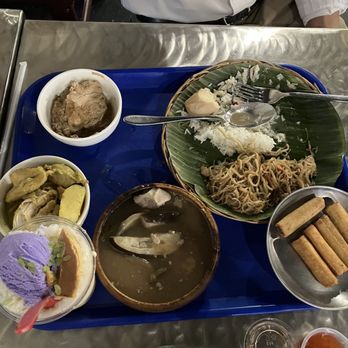
Image resolution: width=348 pixels, height=348 pixels. In order to click on spoon in this screenshot , I will do `click(246, 111)`, `click(41, 301)`.